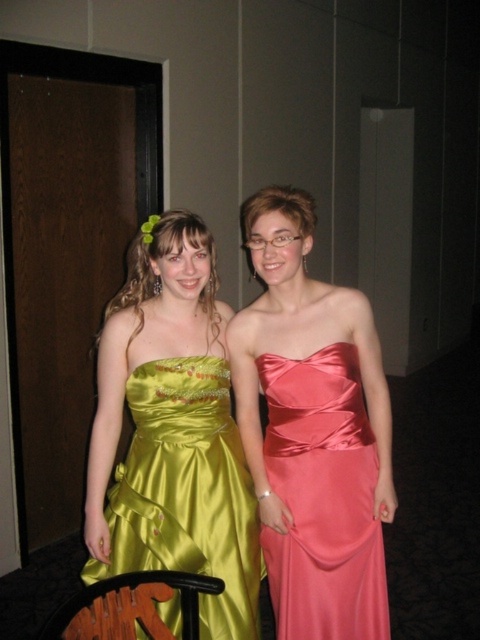
Question: Does green satin dress at left appear on the right side of satin pink dress at center?

Choices:
 (A) yes
 (B) no

Answer: (B)

Question: Can you confirm if green satin dress at left is positioned below satin pink dress at center?

Choices:
 (A) no
 (B) yes

Answer: (B)

Question: Which object appears farthest from the camera in this image?

Choices:
 (A) green satin dress at left
 (B) satin pink dress at center

Answer: (B)

Question: Which point appears closest to the camera in this image?

Choices:
 (A) click(374, 552)
 (B) click(166, 413)

Answer: (A)

Question: Which point is farther from the camera taking this photo?

Choices:
 (A) (282, 419)
 (B) (120, 468)

Answer: (B)

Question: Observing the image, what is the correct spatial positioning of green satin dress at left in reference to satin pink dress at center?

Choices:
 (A) below
 (B) above

Answer: (A)